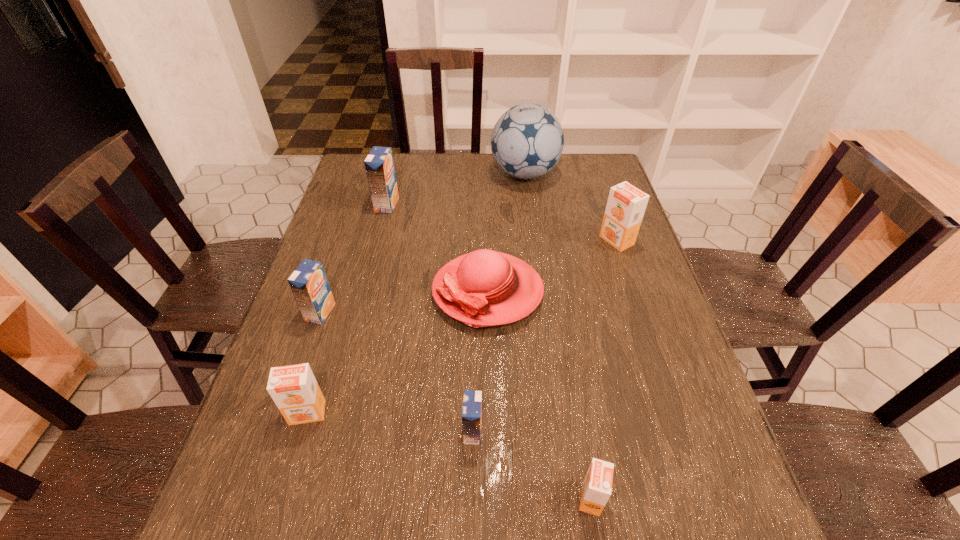
Identify the location of free space between the leftmost orange orange juice and the second farthest object. (348, 309).

At what (x,y) coordinates should I click in order to perform the action: click on empty location between the blue soccer ball and the leftmost orange orange juice. Please return your answer as a coordinate pair (x, y). The image size is (960, 540). Looking at the image, I should click on (416, 293).

This screenshot has width=960, height=540. What are the coordinates of `vacant area that lies between the farthest blue orange_juice and the blue soccer ball` in the screenshot? It's located at (456, 189).

Identify the location of unoccupied position between the third farthest orange juice and the red hat. (x=404, y=302).

Identify the location of free space between the fourth orange juice from left to right and the hat. (480, 361).

Locate an element on the screen. Image resolution: width=960 pixels, height=540 pixels. object that ranks as the third closest to the second nearest orange orange juice is located at coordinates (472, 399).

You are a GUI agent. You are given a task and a screenshot of the screen. Output one action in this format:
    pyautogui.click(x=<x>, y=<y>)
    Task: Click on the object that is the sixth closest to the hat
    This screenshot has height=540, width=960.
    Given the screenshot: What is the action you would take?
    pyautogui.click(x=527, y=141)

Locate which orange juice ranks sixth in proximity to the soccer ball. Please provide its 2D coordinates. Your answer should be formatted as a tuple, i.e. [(x, y)], where the tuple contains the x and y coordinates of a point satisfying the conditions above.

[(596, 490)]

Where is `the fourth closest orange juice to the nearest orange juice`? Image resolution: width=960 pixels, height=540 pixels. the fourth closest orange juice to the nearest orange juice is located at coordinates (309, 284).

Identify the location of the second closest blue orange_juice to the smallest blue orange_juice. The image size is (960, 540). click(379, 164).